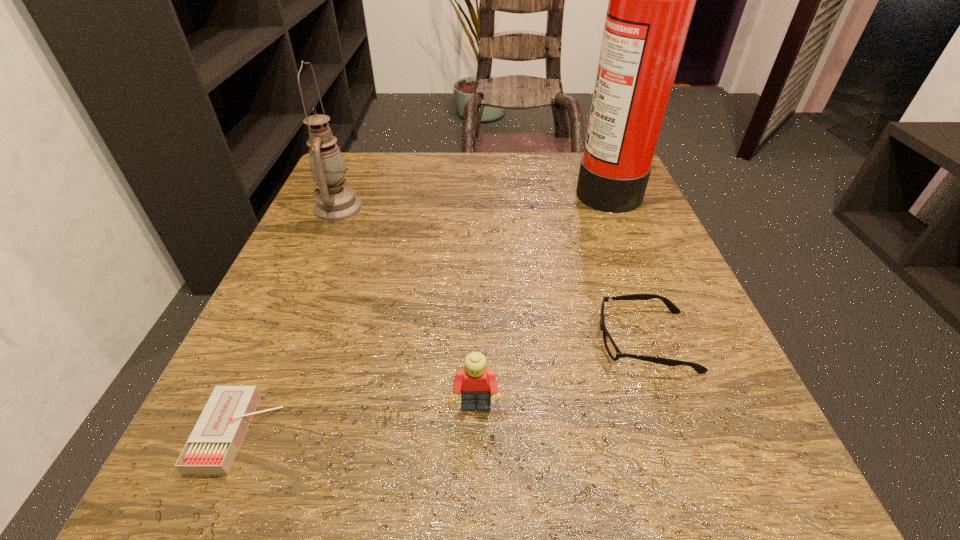
At what (x,y) coordinates should I click in order to perform the action: click on matchbox that is at the left edge. Please return your answer as a coordinate pair (x, y). Looking at the image, I should click on (211, 448).

Locate an element on the screen. The height and width of the screenshot is (540, 960). fire extinguisher located in the right edge section of the desktop is located at coordinates (651, 0).

Locate an element on the screen. spectacles positioned at the right edge is located at coordinates (614, 352).

The width and height of the screenshot is (960, 540). I want to click on object that is at the far left corner, so click(x=334, y=202).

Locate an element on the screen. The height and width of the screenshot is (540, 960). object that is at the near left corner is located at coordinates (211, 448).

This screenshot has width=960, height=540. I want to click on object at the far right corner, so (651, 0).

You are a GUI agent. You are given a task and a screenshot of the screen. Output one action in this format:
    pyautogui.click(x=<x>, y=<y>)
    Task: Click on the free space at the far edge of the desktop
    
    Given the screenshot: What is the action you would take?
    pyautogui.click(x=469, y=202)

Image resolution: width=960 pixels, height=540 pixels. I want to click on blank space at the near edge of the desktop, so click(477, 482).

Identify the location of vacant space at the left edge of the desktop. (336, 225).

This screenshot has width=960, height=540. In the image, there is a desktop. In order to click on vacant space at the right edge in this screenshot , I will do `click(726, 428)`.